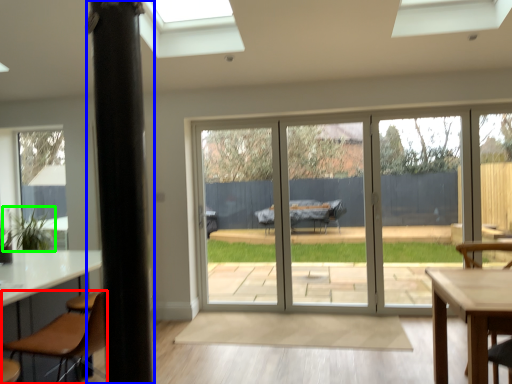
Question: Which object is the closest to the chair (highlighted by a red box)? Choose among these: pillar (highlighted by a blue box) or plant (highlighted by a green box).

Choices:
 (A) pillar
 (B) plant

Answer: (A)